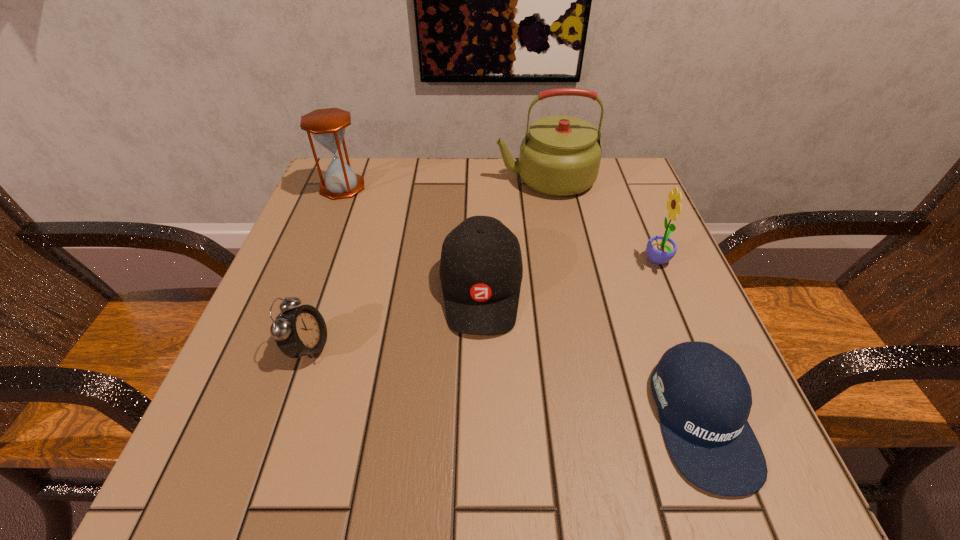
This screenshot has height=540, width=960. What are the coordinates of `kettle` in the screenshot? It's located at (560, 156).

Image resolution: width=960 pixels, height=540 pixels. What are the coordinates of `hourglass` in the screenshot? It's located at (327, 126).

Locate an element on the screen. sunflower is located at coordinates (660, 249).

Find the location of a particular element. the left baseball cap is located at coordinates (481, 270).

The width and height of the screenshot is (960, 540). In order to click on the farther baseball cap in this screenshot , I will do `click(481, 270)`.

Image resolution: width=960 pixels, height=540 pixels. What are the coordinates of `alarm clock` in the screenshot? It's located at (300, 331).

I want to click on the shortest object, so click(704, 399).

What are the coordinates of `the shorter baseball cap` in the screenshot? It's located at (704, 399).

At what (x,y) coordinates should I click in order to perform the action: click on vacant area situated 0.320m at the spout of the tallest object. Please return your answer as a coordinate pair (x, y). This screenshot has height=540, width=960. Looking at the image, I should click on (364, 179).

The height and width of the screenshot is (540, 960). Find the location of `free region located 0.350m at the spout of the tallest object`. free region located 0.350m at the spout of the tallest object is located at coordinates coord(352,179).